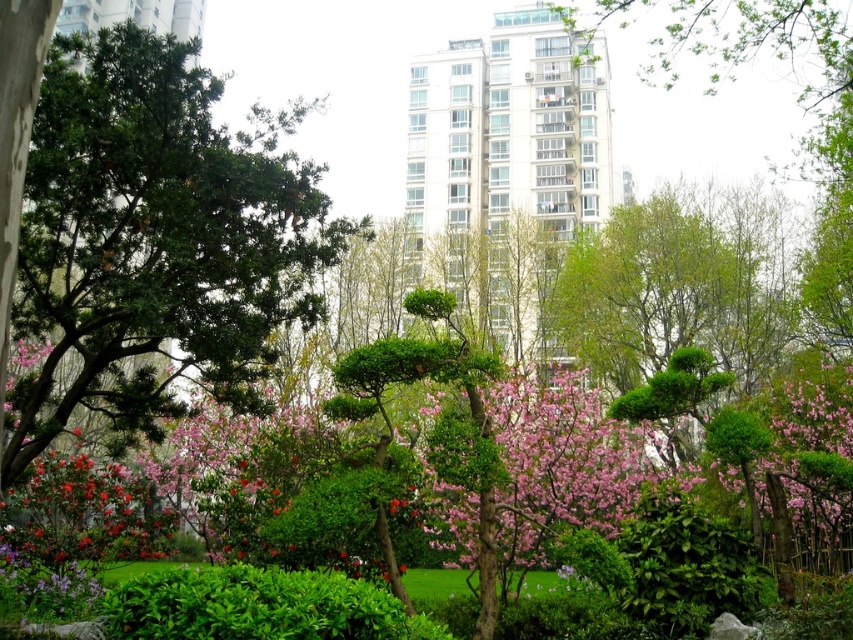
You are a drone operator trying to capture a photo of the pink bloom at center in the urban park scene. The drone is currently at coordinates point 0.5, 0.5. To ensure the bloom is centered in the photo, in which direction should you move the drone? Please specify the direction as either north, south, east, or west based on the coordinate system where the origin is the bottom left corner of the image.

The pink bloom at center is located at point (563, 461). Since the drone is at (426, 320), it needs to move east to increase the x coordinate and north to increase the y coordinate. Therefore, the drone should move northeast to center the bloom.

You are a gardener who wants to plant a new flower in the park. You have a pink bloom at center and a green leafy bush at lower center in your inventory. If you want to choose the wider plant to place in a narrow garden path, which one should you select?

The pink bloom at center has a larger width than the green leafy bush at lower center, so you should choose the pink bloom at center to place in the narrow garden path since it is wider and will fit better in the space.